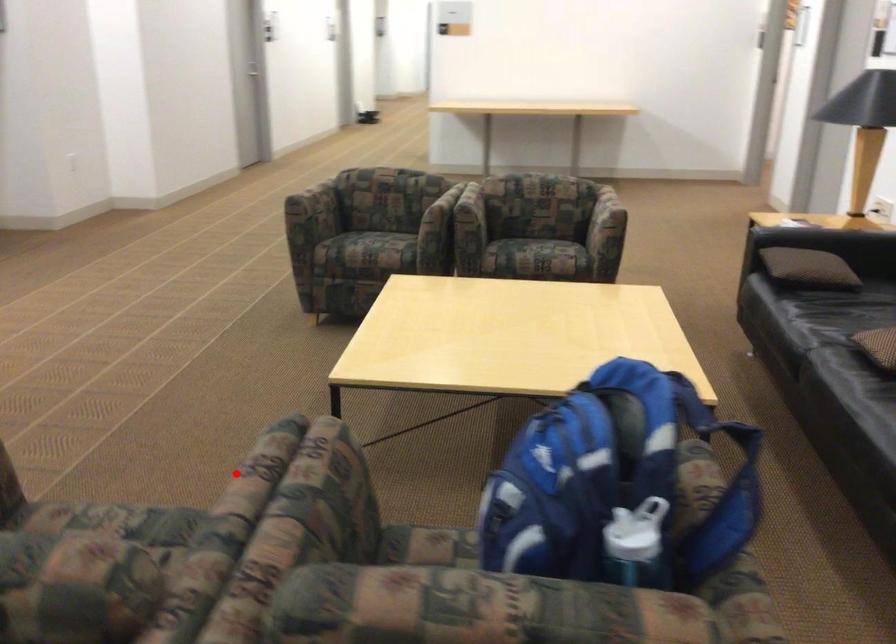
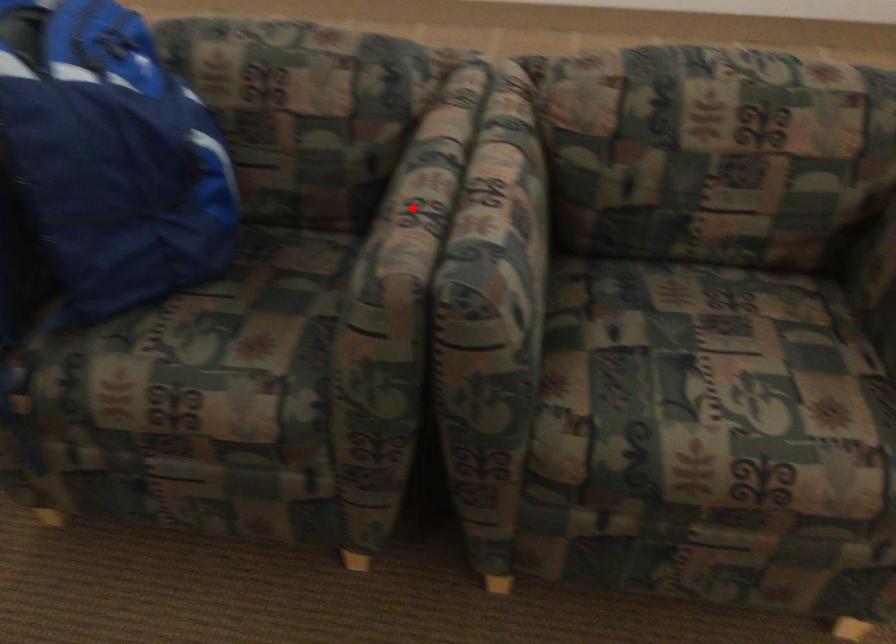
I am providing you with two images of the same scene from different viewpoints. A red point is marked on the first image and another point is marked on the second image. Is the red point in image1 aligned with the point shown in image2?

No